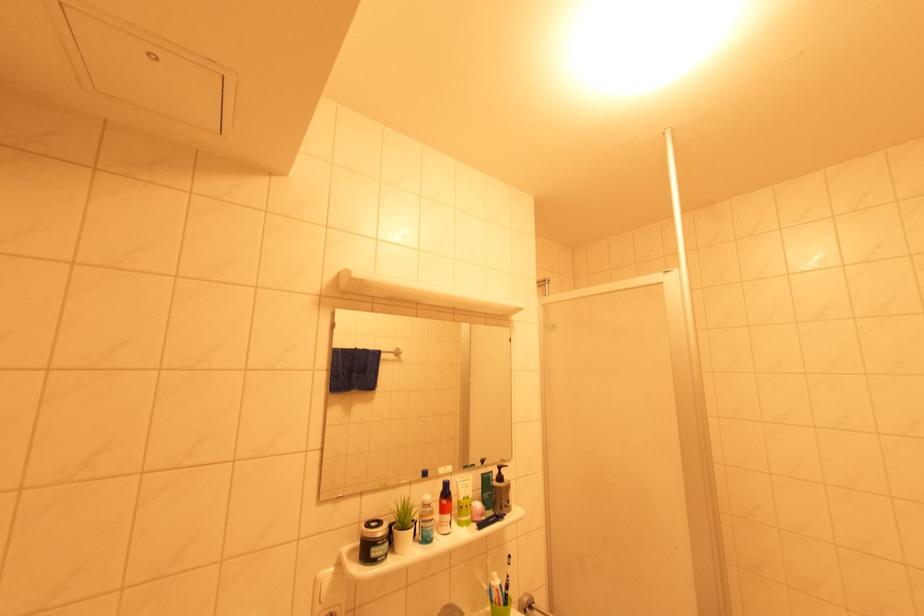
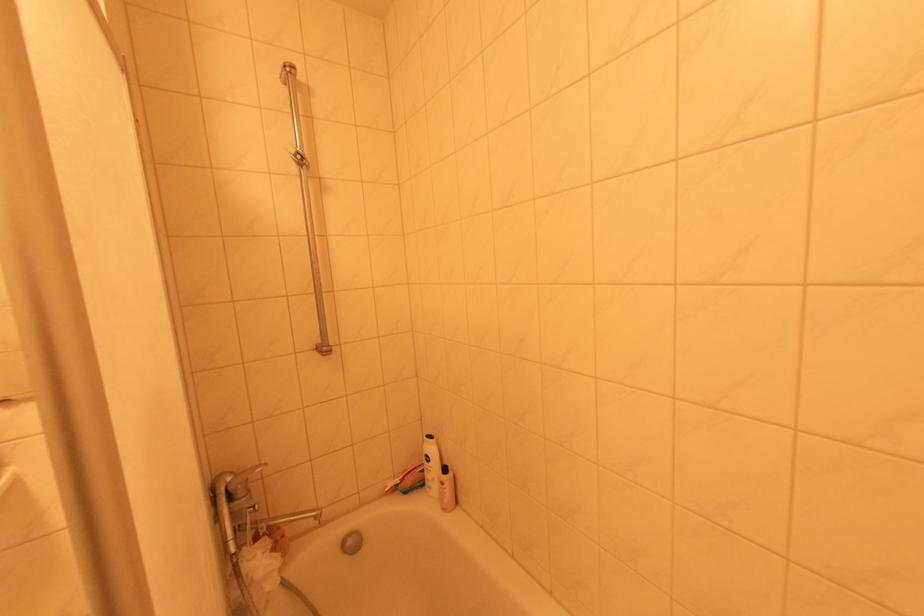
What movement of the cameraman would produce the second image?

→ The movement direction of the cameraman is right, forward.